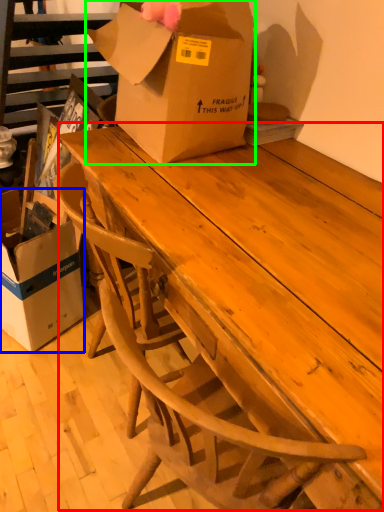
Question: Which object is positioned farthest from table (highlighted by a red box)? Select from box (highlighted by a blue box) and box (highlighted by a green box).

Choices:
 (A) box
 (B) box

Answer: (A)